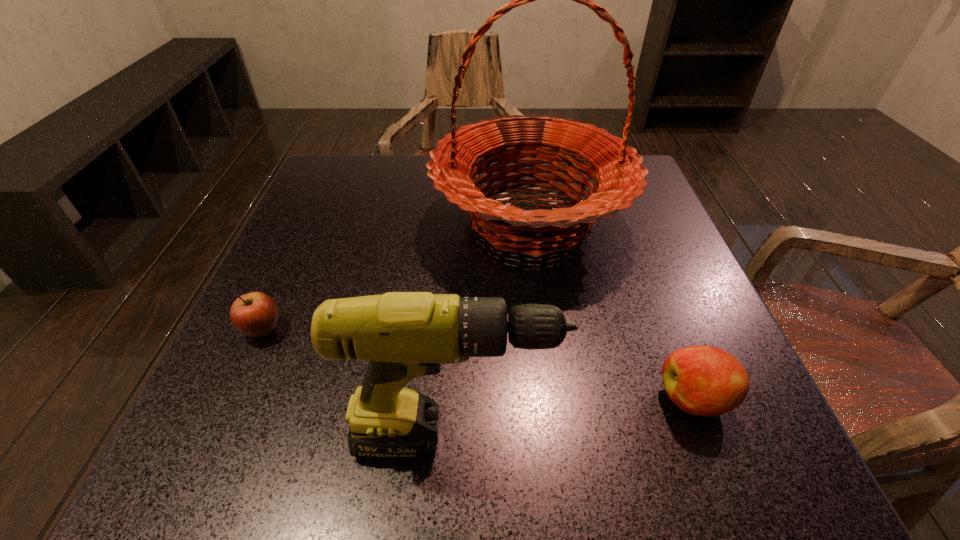
The height and width of the screenshot is (540, 960). Find the location of `free point at the left edge`. free point at the left edge is located at coordinates (288, 378).

Locate an element on the screen. vacant space at the right edge of the desktop is located at coordinates (655, 247).

Find the location of `free location at the far left corner`. free location at the far left corner is located at coordinates (322, 202).

Find the location of a particular element. This screenshot has width=960, height=540. vacant space at the near left corner is located at coordinates (234, 471).

Where is `free spot between the nearer apple and the farthest object`? The height and width of the screenshot is (540, 960). free spot between the nearer apple and the farthest object is located at coordinates (612, 308).

What are the coordinates of `vacant area that lies between the farther apple and the farthest object` in the screenshot? It's located at (397, 274).

Find the location of a particular element. The height and width of the screenshot is (540, 960). free space between the basket and the second farthest object is located at coordinates (397, 274).

Identify the location of free spot between the second tallest object and the farther apple. (359, 384).

Where is `empty space between the drill and the nearer apple`? This screenshot has width=960, height=540. empty space between the drill and the nearer apple is located at coordinates (574, 418).

Locate an element on the screen. Image resolution: width=960 pixels, height=540 pixels. free space between the farther apple and the drill is located at coordinates (359, 384).